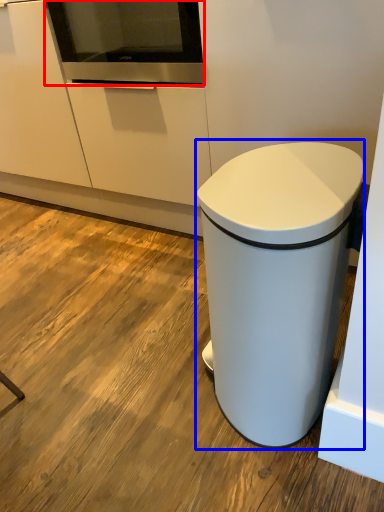
Question: Which object appears farthest to the camera in this image, home appliance (highlighted by a red box) or waste container (highlighted by a blue box)?

Choices:
 (A) home appliance
 (B) waste container

Answer: (A)